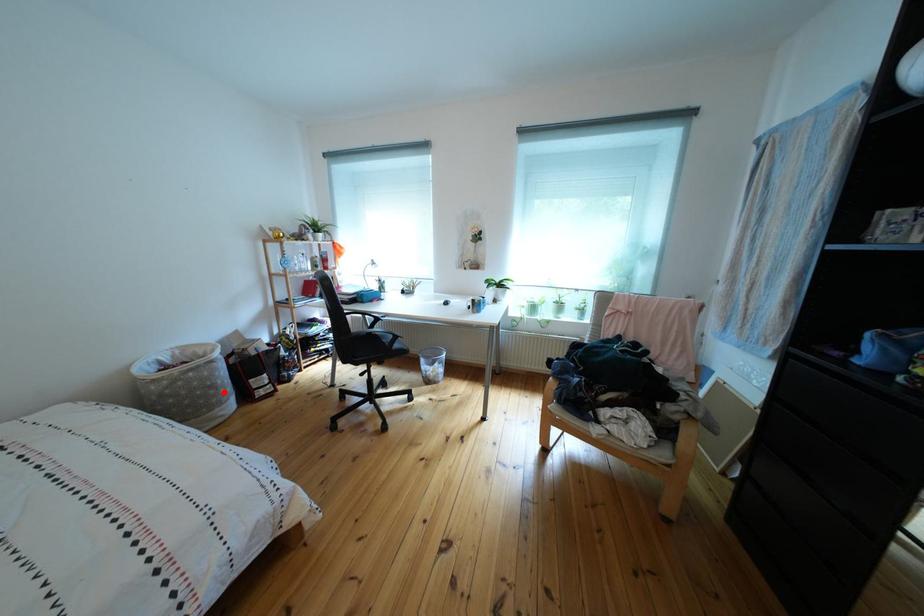
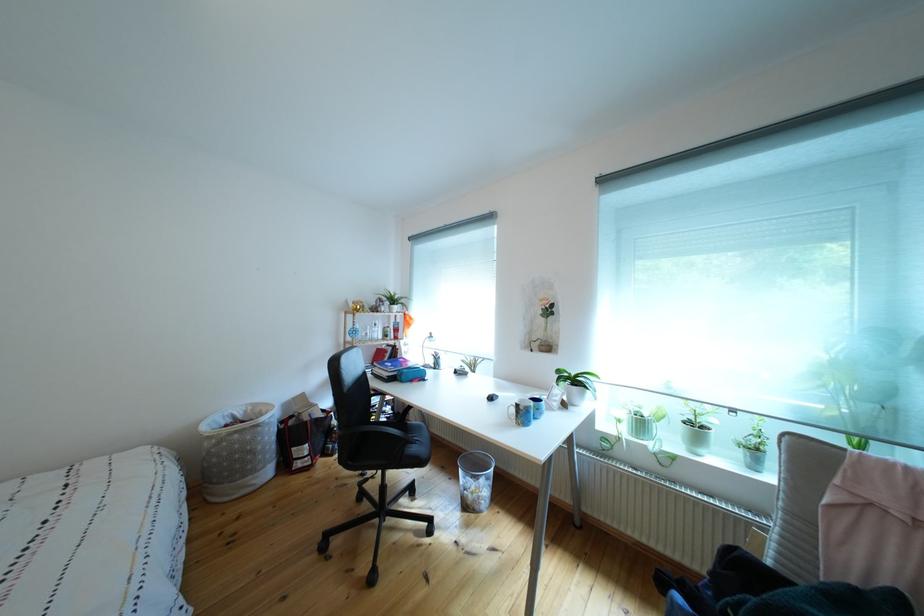
In the second image, find the point that corresponds to the highlighted location in the first image.

(263, 456)